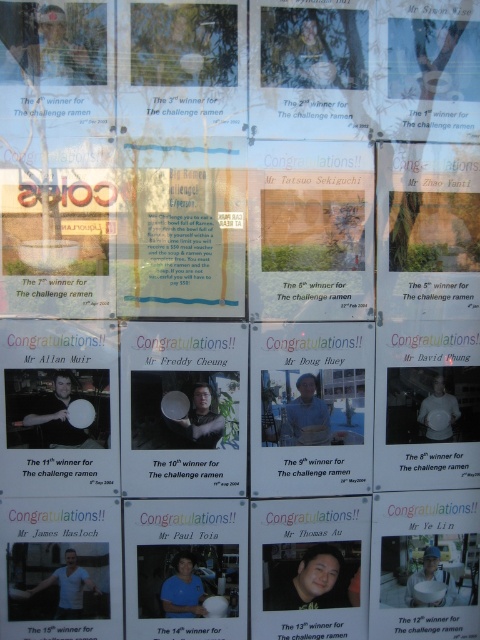
You are a photographer trying to capture a clear shot of both the matte black frisbee at left and the matte black plate at center in the collage. Since both objects are matte black, how might their positioning affect the photo? Please explain using their spatial relationship.

The matte black frisbee at left is in front of the matte black plate at center, so the frisbee may partially obscure the plate in the photo, making it harder to see the plate clearly due to their similar color and overlapping positions.

You are standing in front of the ramen challenge winner collage. You notice two points on the grid layout at coordinates point (173,433) and point (84,588). Which point is closer to your eyes?

Point (173,433) is closer to the camera than point (84,588), so the point at (173,433) is closer to your eyes.

You are standing in front of a collage of ramen challenge winner photos displayed on a reflective glass surface. There is a matte black frisbee at left represented by point (x=58, y=417). If you want to avoid seeing the reflection of the frisbee in the glass, where should you position yourself relative to the point?

To avoid seeing the reflection of the matte black frisbee at left represented by point (x=58, y=417), you should position yourself such that the line of sight to the point does not align with the reflection angle. Since reflections follow the law of reflection, positioning yourself at an angle away from the reflection path would prevent seeing it.